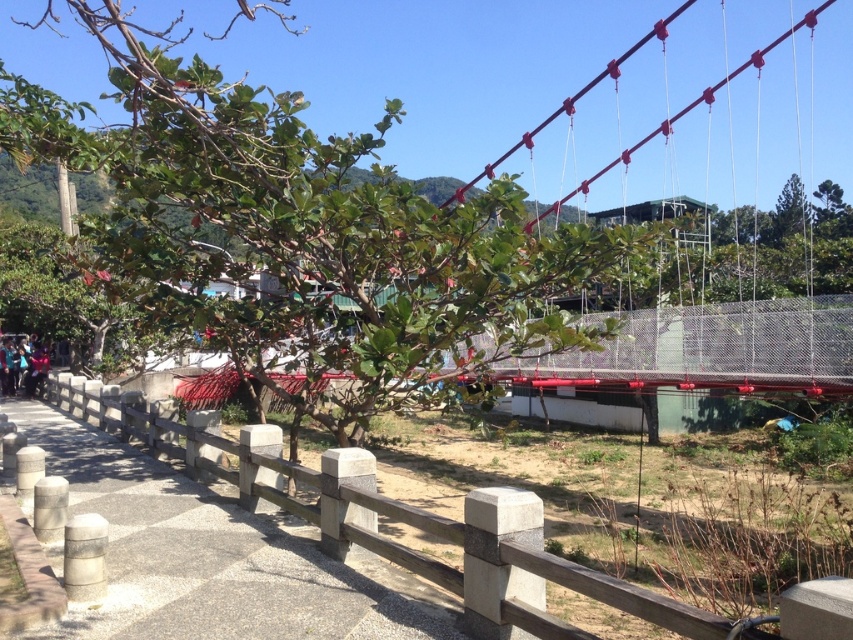
Question: Is green leafy tree at center above blue denim jacket at lower left?

Choices:
 (A) no
 (B) yes

Answer: (B)

Question: Is green leafy tree at center bigger than blue denim jacket at lower left?

Choices:
 (A) no
 (B) yes

Answer: (B)

Question: Can you confirm if green leafy tree at center is thinner than gray concrete fence at center?

Choices:
 (A) no
 (B) yes

Answer: (A)

Question: Which of the following is the farthest from the observer?

Choices:
 (A) (4, 353)
 (B) (190, 445)

Answer: (A)

Question: Estimate the real-world distances between objects in this image. Which object is closer to the gray concrete fence at center?

Choices:
 (A) green leafy tree at center
 (B) blue denim jacket at lower left

Answer: (B)

Question: Estimate the real-world distances between objects in this image. Which object is farther from the green leafy tree at center?

Choices:
 (A) gray concrete fence at center
 (B) blue denim jacket at lower left

Answer: (B)